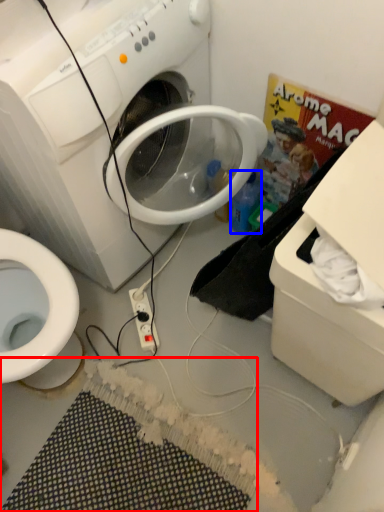
Question: Among these objects, which one is nearest to the camera, bath mat (highlighted by a red box) or bottle (highlighted by a blue box)?

Choices:
 (A) bath mat
 (B) bottle

Answer: (A)